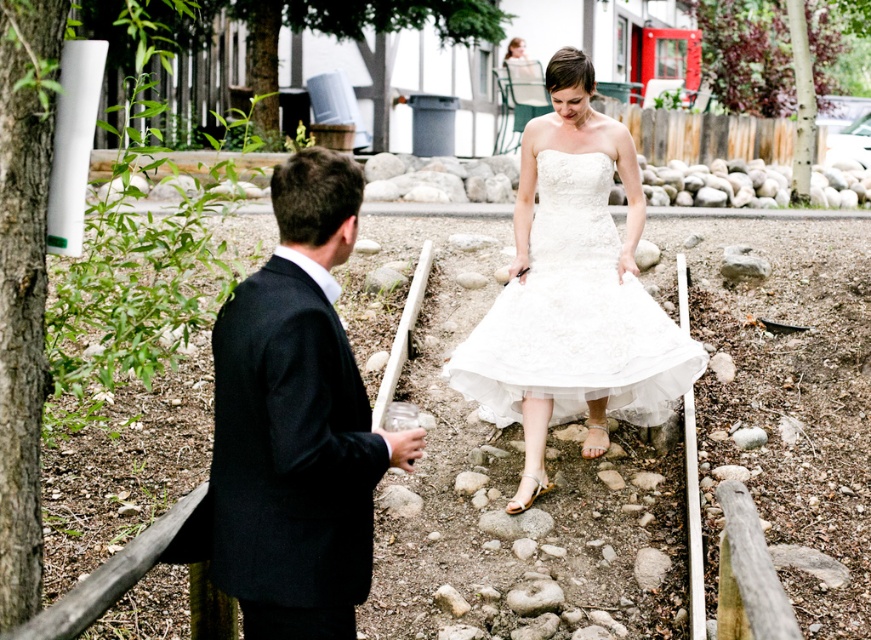
You are a photographer positioned at the origin point in this garden scene. The white satin dress at center is at coordinates point 0.472, 0.666. If you want to capture a closeup of the dress, should you move towards the north or south direction?

The white satin dress at center is located at point [579,301]. Since the y coordinate is 0.666, which is above the origin, moving north would increase the y coordinate further away. To get closer, you should move south to decrease the y coordinate towards the dress.